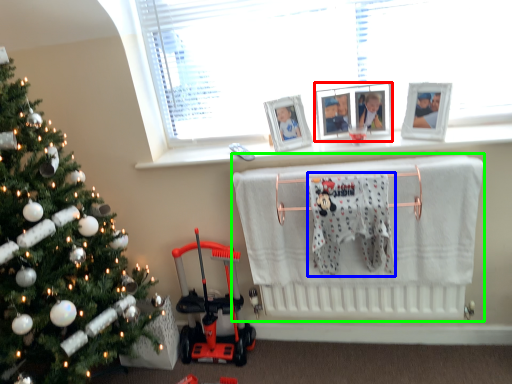
Question: Which object is the farthest from picture frame (highlighted by a red box)? Choose among these: bath towel (highlighted by a blue box) or infant bed (highlighted by a green box).

Choices:
 (A) bath towel
 (B) infant bed

Answer: (B)